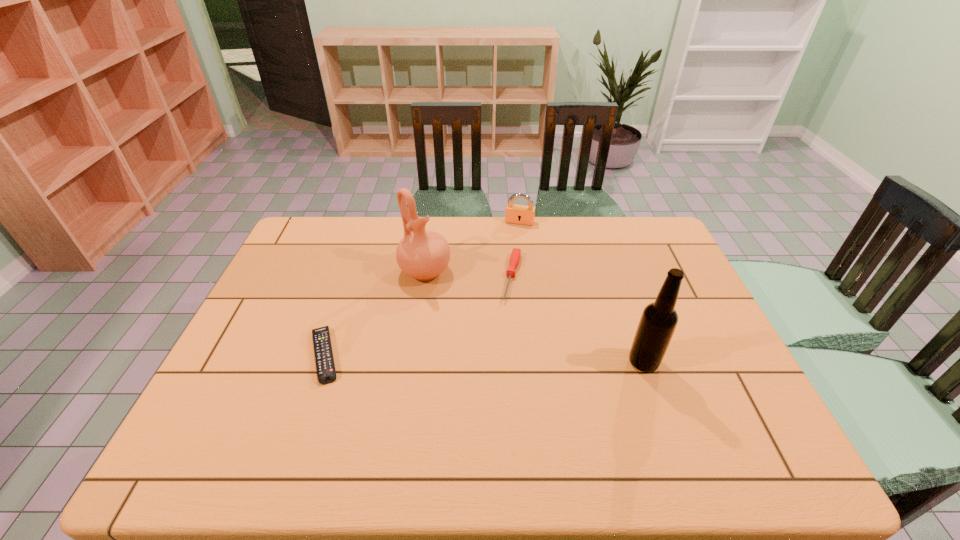
At what (x,y) coordinates should I click in order to perform the action: click on vacant area situated on the spout of the pottery. Please return your answer as a coordinate pair (x, y). Looking at the image, I should click on coord(505,343).

You are a GUI agent. You are given a task and a screenshot of the screen. Output one action in this format:
    pyautogui.click(x=<x>, y=<y>)
    Task: Click on the vacant space located on the spout of the pottery
    Image resolution: width=960 pixels, height=540 pixels.
    Given the screenshot: What is the action you would take?
    pyautogui.click(x=452, y=295)

You are a GUI agent. You are given a task and a screenshot of the screen. Output one action in this format:
    pyautogui.click(x=<x>, y=<y>)
    Task: Click on the blank area located to unlock the farthest object from the front
    The height and width of the screenshot is (540, 960).
    Given the screenshot: What is the action you would take?
    pyautogui.click(x=502, y=280)

Locate an element on the screen. The image size is (960, 540). free point located 0.230m to unlock the farthest object from the front is located at coordinates (506, 266).

I want to click on vacant region located to unlock the farthest object from the front, so click(505, 270).

What are the coordinates of `free space located 0.280m at the tip of the second shortest object` in the screenshot? It's located at (492, 380).

You are a GUI agent. You are given a task and a screenshot of the screen. Output one action in this format:
    pyautogui.click(x=<x>, y=<y>)
    Task: Click on the free region located at the tip of the second shortest object
    The image size is (960, 540).
    Given the screenshot: What is the action you would take?
    pyautogui.click(x=482, y=423)

At what (x,y) coordinates should I click in order to perform the action: click on vacant space located 0.060m at the tip of the second shortest object. Please return your answer as a coordinate pair (x, y). This screenshot has height=540, width=960. Looking at the image, I should click on (508, 318).

Where is `pottery that is at the far edge`? pottery that is at the far edge is located at coordinates (424, 255).

Image resolution: width=960 pixels, height=540 pixels. In order to click on padlock at the far edge in this screenshot , I will do `click(517, 214)`.